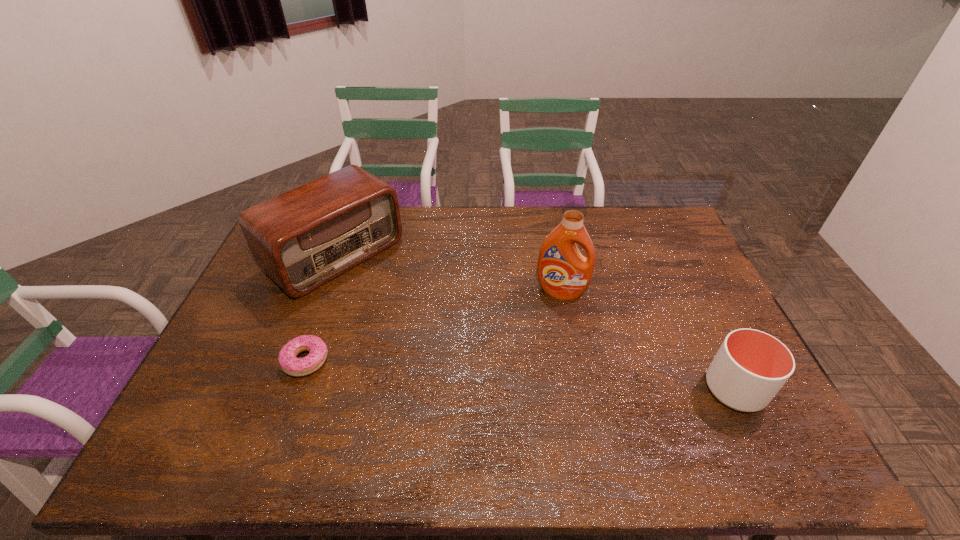
I want to click on vacant space situated 0.170m on the front-facing side of the detergent, so click(x=547, y=342).

The image size is (960, 540). Identify the location of free spot located 0.280m on the front panel of the third shortest object. (433, 334).

Find the location of a particular element. This screenshot has width=960, height=540. vacant space situated on the front panel of the third shortest object is located at coordinates (413, 318).

You are a GUI agent. You are given a task and a screenshot of the screen. Output one action in this format:
    pyautogui.click(x=<x>, y=<y>)
    Task: Click on the vacant region located 0.300m on the front panel of the third shortest object
    
    Given the screenshot: What is the action you would take?
    pyautogui.click(x=438, y=338)

Where is `object positioned at the far edge`? The image size is (960, 540). object positioned at the far edge is located at coordinates (303, 238).

Locate an element on the screen. This screenshot has width=960, height=540. object at the near edge is located at coordinates (751, 366).

Identify the location of object at the left edge. The image size is (960, 540). (303, 238).

This screenshot has height=540, width=960. I want to click on object that is at the right edge, so click(x=751, y=366).

At what (x,y) coordinates should I click in order to perform the action: click on object located in the far left corner section of the desktop. Please return your answer as a coordinate pair (x, y). This screenshot has height=540, width=960. Looking at the image, I should click on (303, 238).

Find the location of a particular element. The height and width of the screenshot is (540, 960). object present at the near right corner is located at coordinates (751, 366).